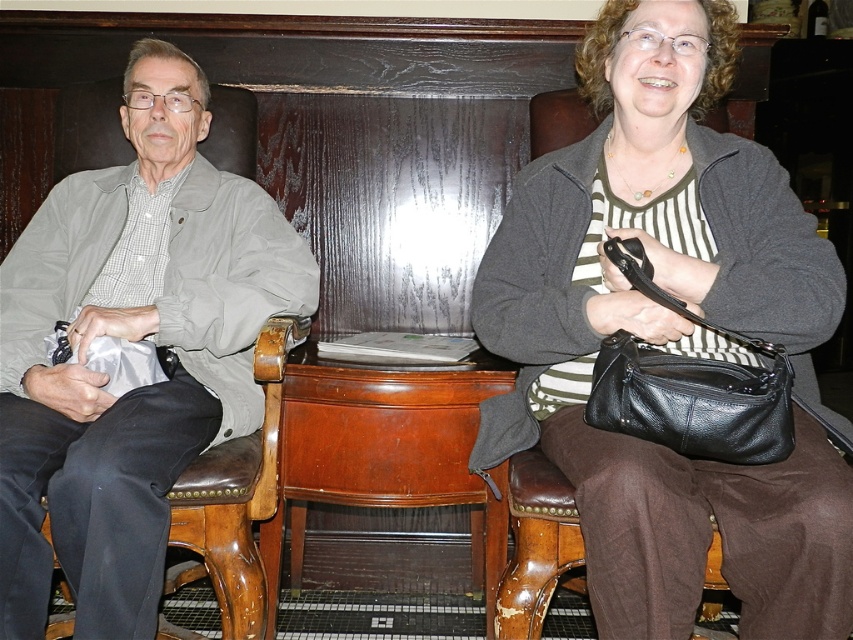
Who is positioned more to the left, matte black purse at right or brown leather stool at lower right?

From the viewer's perspective, brown leather stool at lower right appears more on the left side.

Between point (614, 595) and point (573, 520), which one is positioned behind?

The point (573, 520) is more distant.

Identify the location of matte black purse at right. (670, 337).

Can you confirm if matte gray jacket at left is wider than brown leather stool at lower right?

Yes, matte gray jacket at left is wider than brown leather stool at lower right.

Between point (167, 102) and point (526, 529), which one is positioned behind?

Positioned behind is point (167, 102).

At what (x,y) coordinates should I click in order to perform the action: click on matte gray jacket at left. Please return your answer as a coordinate pair (x, y). The height and width of the screenshot is (640, 853). Looking at the image, I should click on (131, 339).

Does matte black purse at right appear on the left side of matte gray jacket at left?

Incorrect, matte black purse at right is not on the left side of matte gray jacket at left.

Is matte black purse at right to the right of matte gray jacket at left from the viewer's perspective?

Indeed, matte black purse at right is positioned on the right side of matte gray jacket at left.

This screenshot has width=853, height=640. Find the location of `matte black purse at right`. matte black purse at right is located at coordinates (670, 337).

Locate an element on the screen. matte black purse at right is located at coordinates (670, 337).